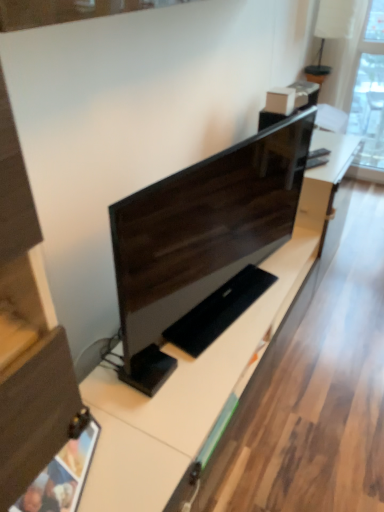
Question: Does matte black monitor at center have a larger size compared to matte wood drawer at lower left?

Choices:
 (A) yes
 (B) no

Answer: (A)

Question: From a real-world perspective, does matte black monitor at center sit lower than matte wood drawer at lower left?

Choices:
 (A) no
 (B) yes

Answer: (A)

Question: Is matte black monitor at center facing away from matte wood drawer at lower left?

Choices:
 (A) yes
 (B) no

Answer: (B)

Question: Is matte black monitor at center wider than matte wood drawer at lower left?

Choices:
 (A) no
 (B) yes

Answer: (B)

Question: Is the depth of matte black monitor at center less than that of matte wood drawer at lower left?

Choices:
 (A) yes
 (B) no

Answer: (B)

Question: Is matte black monitor at center further to the viewer compared to matte wood drawer at lower left?

Choices:
 (A) yes
 (B) no

Answer: (A)

Question: From the image's perspective, is matte wood drawer at lower left on top of matte black monitor at center?

Choices:
 (A) no
 (B) yes

Answer: (A)

Question: Are matte wood drawer at lower left and matte black monitor at center beside each other?

Choices:
 (A) yes
 (B) no

Answer: (B)

Question: From a real-world perspective, is matte wood drawer at lower left physically above matte black monitor at center?

Choices:
 (A) no
 (B) yes

Answer: (A)

Question: Considering the relative sizes of matte wood drawer at lower left and matte black monitor at center in the image provided, is matte wood drawer at lower left bigger than matte black monitor at center?

Choices:
 (A) no
 (B) yes

Answer: (A)

Question: Is matte wood drawer at lower left facing towards matte black monitor at center?

Choices:
 (A) no
 (B) yes

Answer: (A)

Question: Is matte wood drawer at lower left positioned beyond the bounds of matte black monitor at center?

Choices:
 (A) no
 (B) yes

Answer: (B)

Question: Is matte wood drawer at lower left inside or outside of matte black monitor at center?

Choices:
 (A) inside
 (B) outside

Answer: (B)